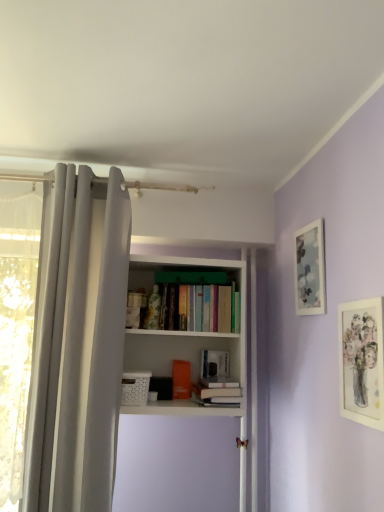
You are a GUI agent. You are given a task and a screenshot of the screen. Output one action in this format:
    pyautogui.click(x=<x>, y=<y>)
    Task: Click on the vacant area on top of white fabric curtain at left (from a real-world perspective)
    Image resolution: width=384 pixels, height=512 pixels.
    Given the screenshot: What is the action you would take?
    pyautogui.click(x=95, y=160)